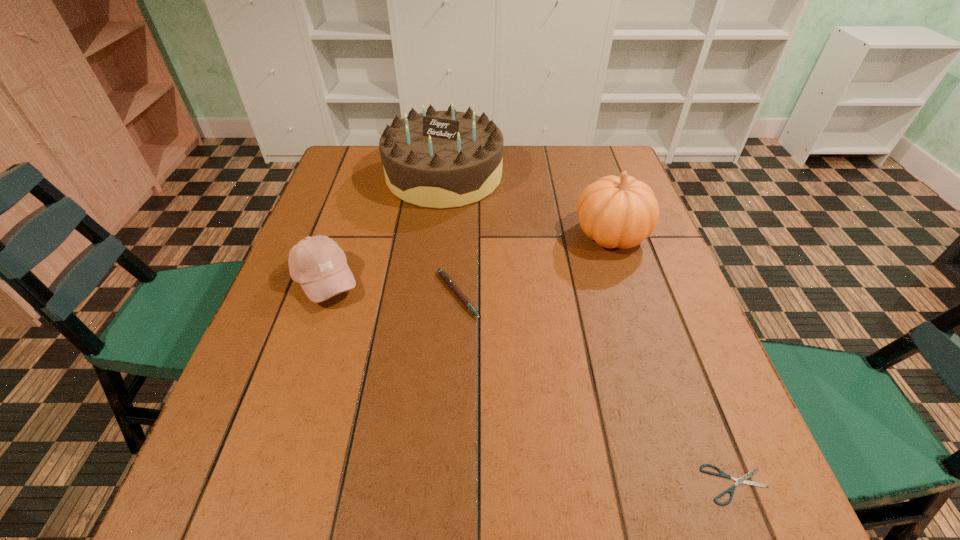
The image size is (960, 540). What are the coordinates of `the farthest object` in the screenshot? It's located at (436, 159).

This screenshot has width=960, height=540. I want to click on pumpkin, so click(x=621, y=212).

Image resolution: width=960 pixels, height=540 pixels. I want to click on baseball cap, so click(x=318, y=264).

Find the location of a particular element. the fourth tallest object is located at coordinates (444, 276).

In order to click on the shortest object in this screenshot , I will do `click(731, 490)`.

Identify the location of shears. (731, 490).

Locate an element on the screen. Image resolution: width=960 pixels, height=540 pixels. vacant area situated 0.130m on the front-facing side of the farthest object is located at coordinates (437, 241).

Locate an element on the screen. Image resolution: width=960 pixels, height=540 pixels. vacant area located on the left of the pumpkin is located at coordinates (520, 235).

Locate an element on the screen. The height and width of the screenshot is (540, 960). vacant space located on the front-facing side of the baseball cap is located at coordinates (535, 281).

Identify the location of free location located at the nib of the fourth tallest object. (640, 295).